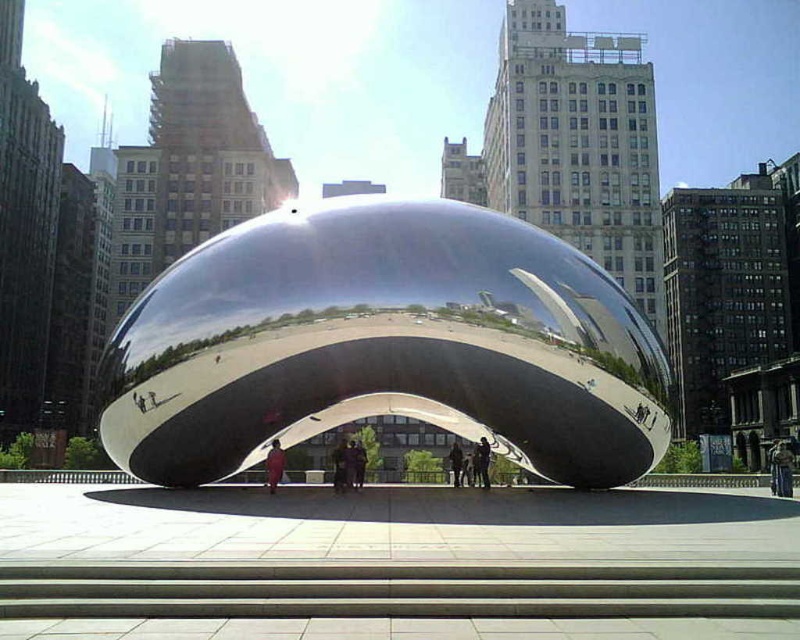
You are standing in front of the metallic sculpture and see both the red fabric coat at center and the dark blue fabric at center. Which fabric is located to the left when viewed from your perspective?

The red fabric coat at center is positioned on the left side of the dark blue fabric at center, so from your perspective, the red fabric coat at center is to the left.

You are an artist observing the sculpture and the people around it. You notice a red fabric coat at center and a dark gray fabric jacket at center. Which clothing item is positioned higher relative to the other?

The red fabric coat at center is above the dark gray fabric jacket at center, so the red fabric coat at center is positioned higher.